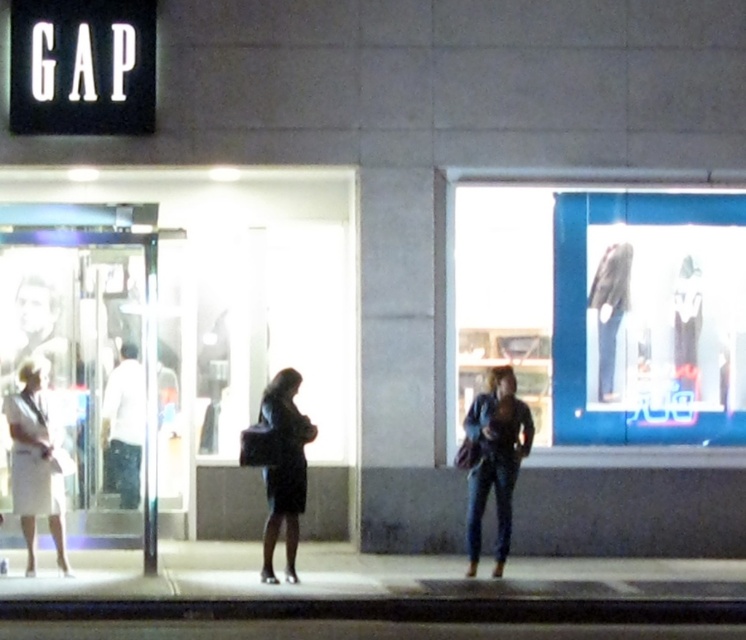
Based on the scene description, which object is bigger between the white matte skirt at left and the dark blue fabric coat at center?

The white matte skirt at left is larger in size compared to the dark blue fabric coat at center according to the description.

You are a fashion designer observing the Gap store scene. You notice the white matte skirt at left and the dark blue fabric coat at center. Which clothing item is located more to the left?

The white matte skirt at left is more to the left than the dark blue fabric coat at center.

You are a customer looking at the Gap store display. Are the blue glass display at center and denim jeans at center positioned in a way that one is above the other?

Yes, the blue glass display at center is above the denim jeans at center.